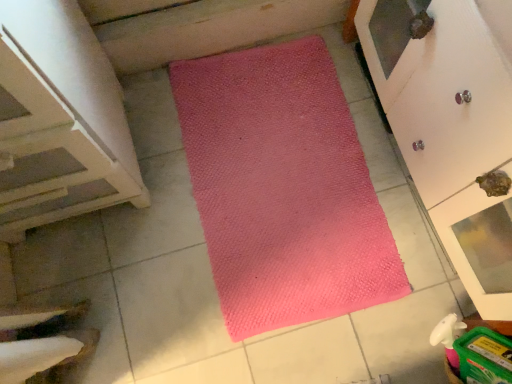
Question: Does matte white cupboard at upper right have a lesser width compared to pink textured mat at center?

Choices:
 (A) no
 (B) yes

Answer: (B)

Question: Considering the relative sizes of matte white cupboard at upper right and pink textured mat at center in the image provided, is matte white cupboard at upper right shorter than pink textured mat at center?

Choices:
 (A) yes
 (B) no

Answer: (B)

Question: Is matte white cupboard at upper right smaller than pink textured mat at center?

Choices:
 (A) no
 (B) yes

Answer: (A)

Question: From a real-world perspective, is matte white cupboard at upper right below pink textured mat at center?

Choices:
 (A) no
 (B) yes

Answer: (A)

Question: Is matte white cupboard at upper right looking in the opposite direction of pink textured mat at center?

Choices:
 (A) yes
 (B) no

Answer: (B)

Question: Does matte white cupboard at upper right appear on the right side of pink textured mat at center?

Choices:
 (A) yes
 (B) no

Answer: (A)

Question: Is pink textured mat at center facing towards white wood stairs at left?

Choices:
 (A) no
 (B) yes

Answer: (B)

Question: Would you say pink textured mat at center is a long distance from white wood stairs at left?

Choices:
 (A) no
 (B) yes

Answer: (A)

Question: Is pink textured mat at center at the right side of white wood stairs at left?

Choices:
 (A) no
 (B) yes

Answer: (B)

Question: Considering the relative sizes of pink textured mat at center and white wood stairs at left in the image provided, is pink textured mat at center shorter than white wood stairs at left?

Choices:
 (A) no
 (B) yes

Answer: (B)

Question: Is pink textured mat at center turned away from white wood stairs at left?

Choices:
 (A) yes
 (B) no

Answer: (B)

Question: Is pink textured mat at center positioned before white wood stairs at left?

Choices:
 (A) yes
 (B) no

Answer: (B)

Question: From the image's perspective, is pink textured mat at center located beneath matte white cupboard at upper right?

Choices:
 (A) yes
 (B) no

Answer: (A)